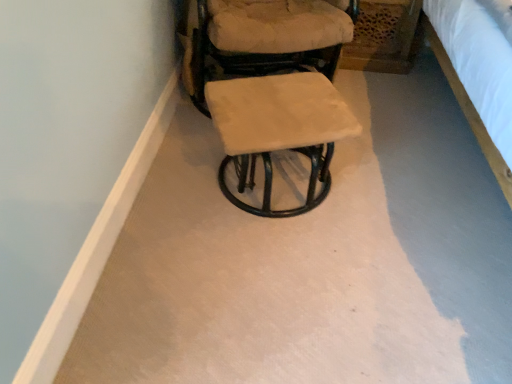
Where is `vacant space in front of white fabric chair at center`? This screenshot has width=512, height=384. vacant space in front of white fabric chair at center is located at coordinates [x=267, y=186].